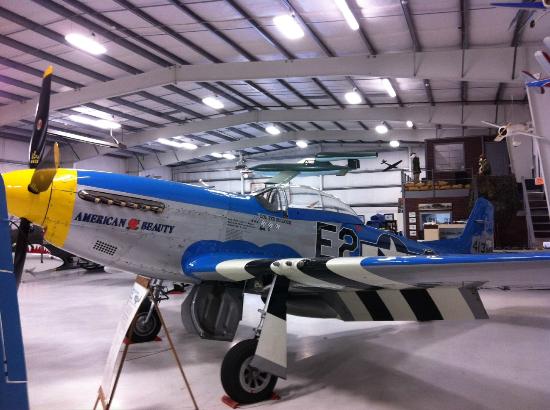
Identify the location of yellow paint. The width and height of the screenshot is (550, 410). (46, 201).